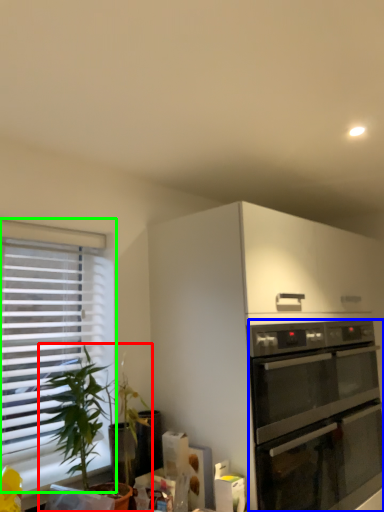
Question: Which object is positioned closest to houseplant (highlighted by a red box)? Select from oven (highlighted by a blue box) and window (highlighted by a green box).

Choices:
 (A) oven
 (B) window

Answer: (B)